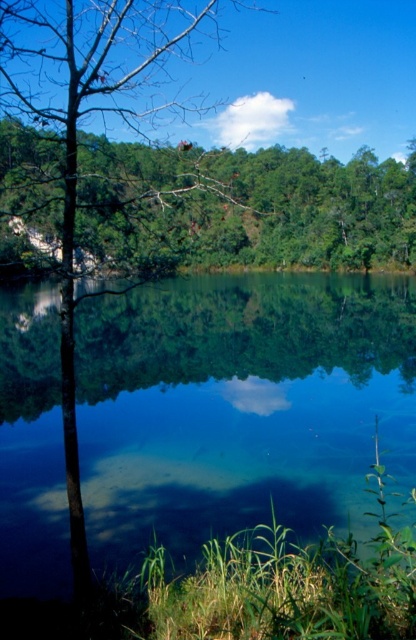
Question: Does clear glass water at center appear on the right side of green matte tree at upper center?

Choices:
 (A) no
 (B) yes

Answer: (A)

Question: Which of the following is the farthest from the observer?

Choices:
 (A) (91, 70)
 (B) (56, 445)

Answer: (B)

Question: Which of the following is the farthest from the observer?

Choices:
 (A) (250, 449)
 (B) (178, 236)

Answer: (B)

Question: In this image, where is green matte tree at upper center located relative to smooth bark tree at center?

Choices:
 (A) left
 (B) right

Answer: (B)

Question: Does clear glass water at center appear over smooth bark tree at center?

Choices:
 (A) no
 (B) yes

Answer: (A)

Question: Which of the following is the closest to the observer?

Choices:
 (A) clear glass water at center
 (B) smooth bark tree at center

Answer: (B)